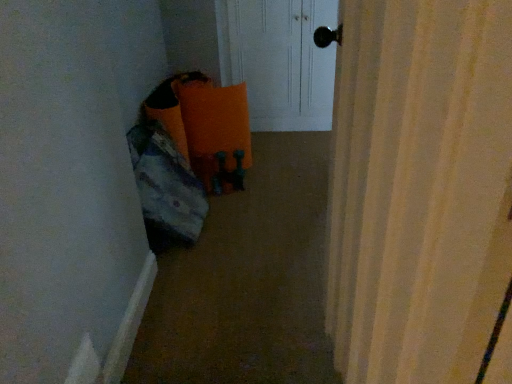
Question: From a real-world perspective, is white glossy door at upper center located beneath carpeted floor at lower left?

Choices:
 (A) yes
 (B) no

Answer: (B)

Question: From the image's perspective, is white glossy door at upper center over carpeted floor at lower left?

Choices:
 (A) no
 (B) yes

Answer: (B)

Question: Is white glossy door at upper center taller than carpeted floor at lower left?

Choices:
 (A) yes
 (B) no

Answer: (A)

Question: From the image's perspective, is white glossy door at upper center below carpeted floor at lower left?

Choices:
 (A) no
 (B) yes

Answer: (A)

Question: Considering the relative sizes of white glossy door at upper center and carpeted floor at lower left in the image provided, is white glossy door at upper center wider than carpeted floor at lower left?

Choices:
 (A) yes
 (B) no

Answer: (B)

Question: Can you confirm if white glossy door at upper center is thinner than carpeted floor at lower left?

Choices:
 (A) yes
 (B) no

Answer: (A)

Question: From a real-world perspective, does carpeted floor at lower left sit lower than white glossy door at upper center?

Choices:
 (A) yes
 (B) no

Answer: (A)

Question: Is carpeted floor at lower left smaller than white glossy door at upper center?

Choices:
 (A) no
 (B) yes

Answer: (B)

Question: Can you confirm if carpeted floor at lower left is thinner than white glossy door at upper center?

Choices:
 (A) no
 (B) yes

Answer: (A)

Question: Is carpeted floor at lower left completely or partially outside of white glossy door at upper center?

Choices:
 (A) yes
 (B) no

Answer: (A)

Question: Does carpeted floor at lower left have a lesser height compared to white glossy door at upper center?

Choices:
 (A) no
 (B) yes

Answer: (B)

Question: Is carpeted floor at lower left wider than white glossy door at upper center?

Choices:
 (A) yes
 (B) no

Answer: (A)

Question: Is white glossy door at upper center wider or thinner than carpeted floor at lower left?

Choices:
 (A) wide
 (B) thin

Answer: (B)